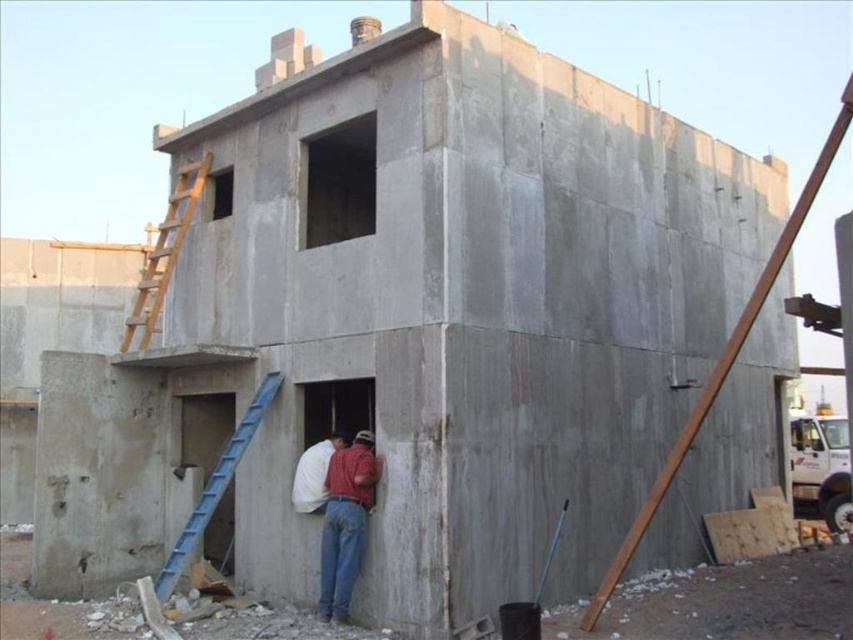
Question: Which of the following is the farthest from the observer?

Choices:
 (A) red shirt at center
 (B) white matte shirt at center

Answer: (B)

Question: From the image, what is the correct spatial relationship of wooden ladder at upper left in relation to blue plastic ladder at lower left?

Choices:
 (A) below
 (B) above

Answer: (B)

Question: Which point is closer to the camera?

Choices:
 (A) white matte shirt at center
 (B) wooden ladder at upper left

Answer: (A)

Question: Can you confirm if wooden ladder at upper left is positioned below blue plastic ladder at lower left?

Choices:
 (A) yes
 (B) no

Answer: (B)

Question: Among these points, which one is nearest to the camera?

Choices:
 (A) (323, 609)
 (B) (173, 554)
 (C) (326, 452)

Answer: (A)

Question: Can you confirm if red shirt at center is thinner than white matte shirt at center?

Choices:
 (A) no
 (B) yes

Answer: (A)